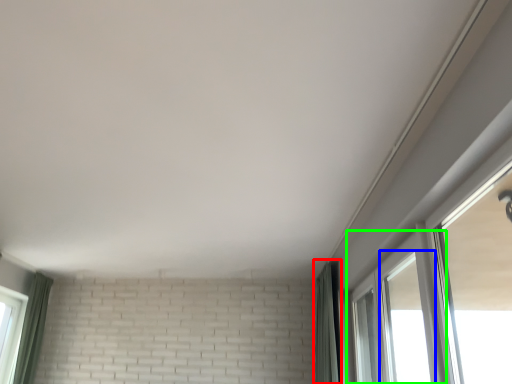
Question: Which object is positioned farthest from curtain (highlighted by a red box)? Select from window (highlighted by a blue box) and window (highlighted by a green box).

Choices:
 (A) window
 (B) window

Answer: (A)